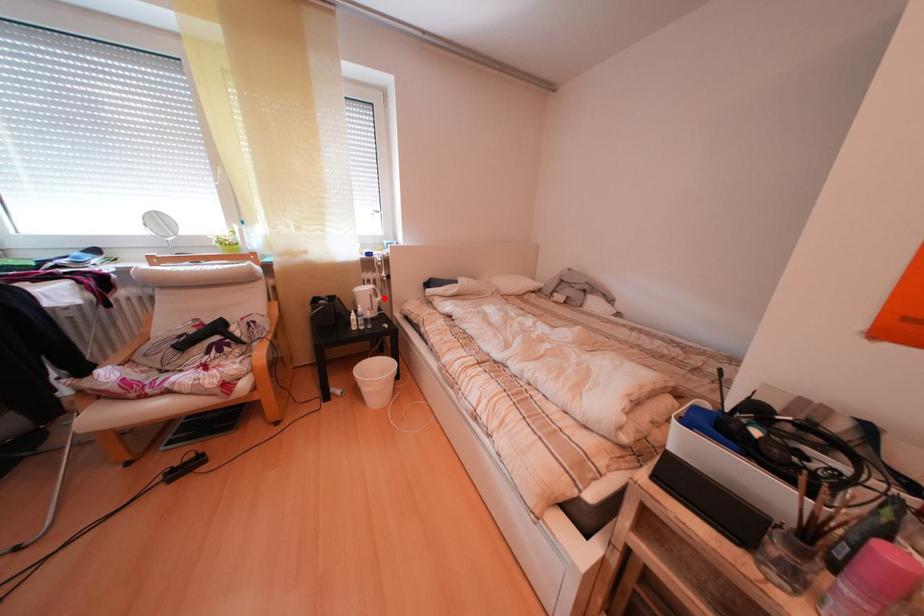
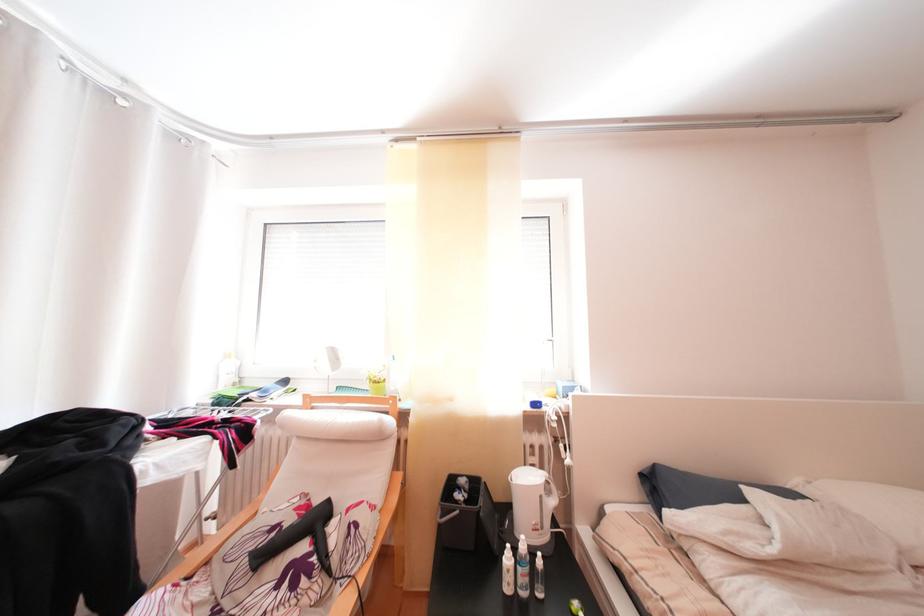
Question: I am providing you with two images of the same scene from different viewpoints. Given a red point in image1, look at the same physical point in image2. Is it:

Choices:
 (A) Closer to the viewpoint
 (B) Farther from the viewpoint

Answer: (B)